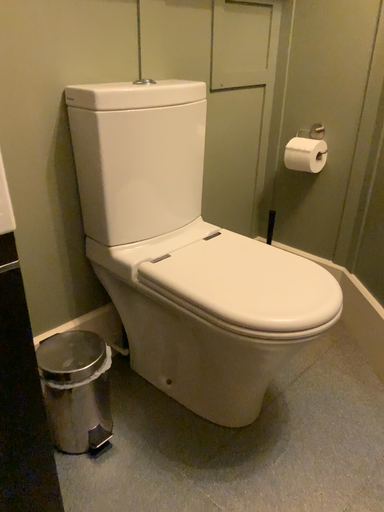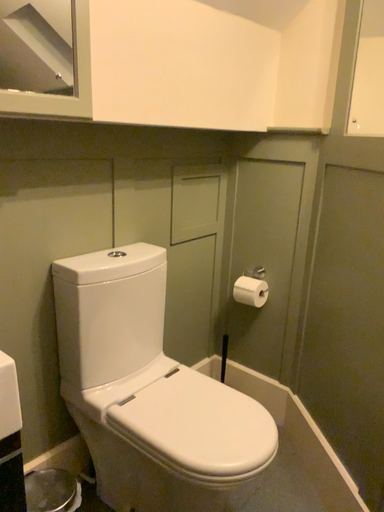
Question: How did the camera likely rotate when shooting the video?

Choices:
 (A) rotated downward
 (B) rotated upward

Answer: (B)